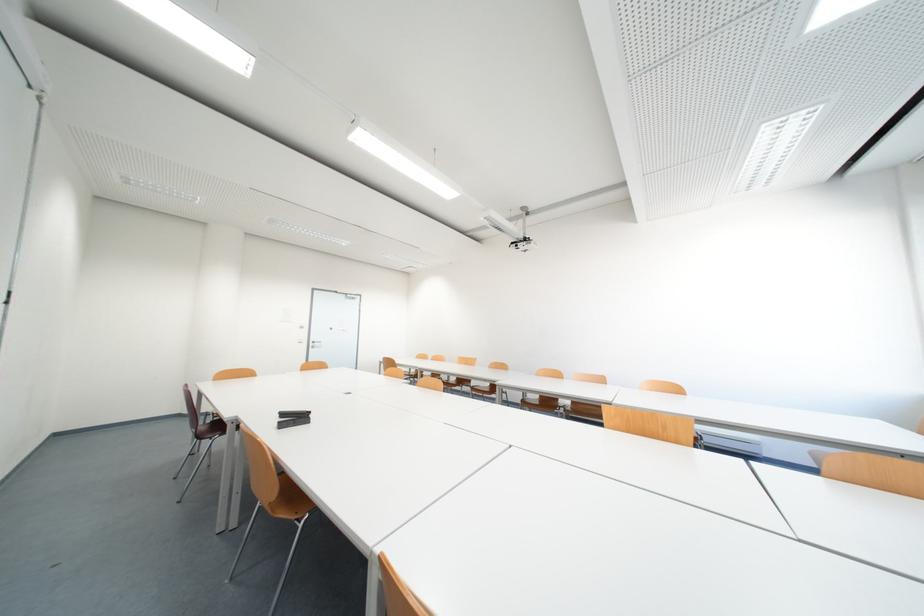
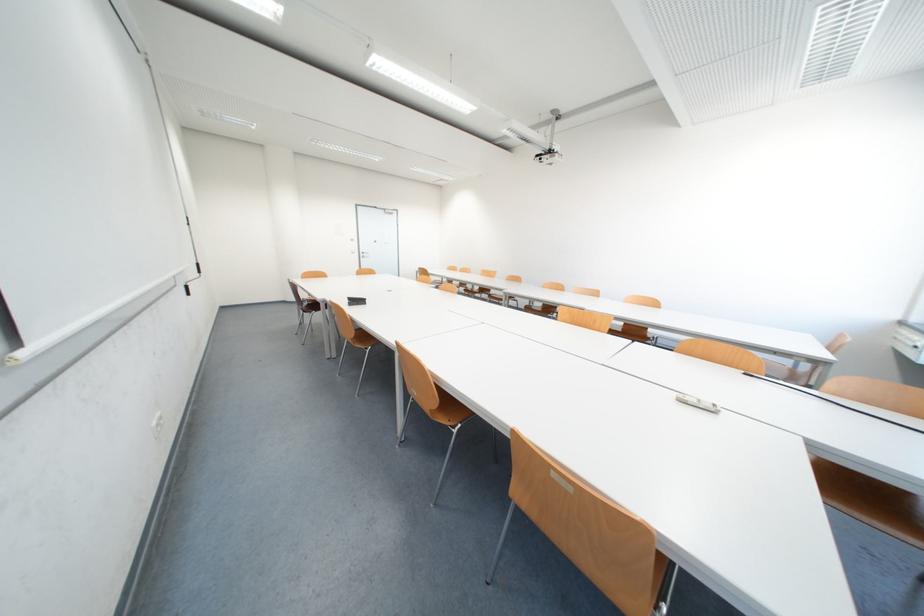
Question: The first image is from the beginning of the video and the second image is from the end. How did the camera likely rotate when shooting the video?

Choices:
 (A) Left
 (B) Right
 (C) Up
 (D) Down

Answer: (D)